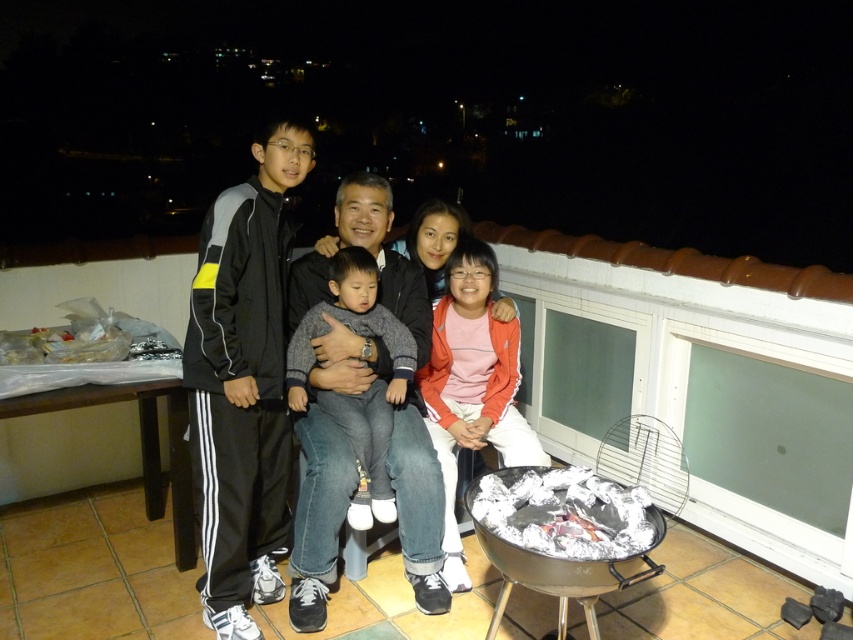
Between dark blue jeans at center and orange fleece jacket at center, which one has less height?

orange fleece jacket at center is shorter.

In the scene shown: Which of these two, dark blue jeans at center or orange fleece jacket at center, stands taller?

With more height is dark blue jeans at center.

I want to click on dark blue jeans at center, so click(x=317, y=515).

Which is below, dark blue jeans at center or gray soft sweater at center?

dark blue jeans at center is lower down.

Can you confirm if dark blue jeans at center is shorter than gray soft sweater at center?

In fact, dark blue jeans at center may be taller than gray soft sweater at center.

Where is `dark blue jeans at center`? This screenshot has width=853, height=640. dark blue jeans at center is located at coordinates (317, 515).

Who is more forward, (410, 579) or (254, 317)?

Point (254, 317)

Is matte black jacket at center to the left of black athletic suit at left from the viewer's perspective?

Incorrect, matte black jacket at center is not on the left side of black athletic suit at left.

Describe the element at coordinates (241, 268) in the screenshot. The image size is (853, 640). I see `matte black jacket at center` at that location.

The image size is (853, 640). I want to click on matte black jacket at center, so [x=241, y=268].